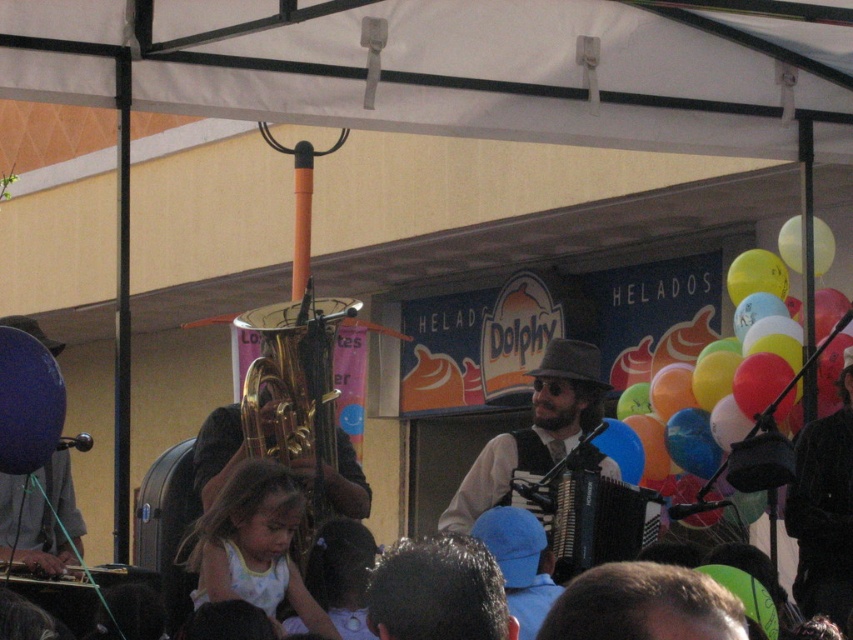
Is matte brown hat at center below blue matte balloon at left?

Indeed, matte brown hat at center is positioned under blue matte balloon at left.

Is matte brown hat at center to the left of blue matte balloon at left from the viewer's perspective?

Incorrect, matte brown hat at center is not on the left side of blue matte balloon at left.

Find the location of `matte brown hat at center`. matte brown hat at center is located at coordinates (534, 429).

Who is more forward, (x=828, y=588) or (x=795, y=260)?

Point (x=828, y=588)

Can you confirm if matte black hat at center is smaller than yellow matte balloon at upper right?

No.

Between point (846, 394) and point (819, 244), which one is positioned in front?

Point (846, 394)

You are a GUI agent. You are given a task and a screenshot of the screen. Output one action in this format:
    pyautogui.click(x=<x>, y=<y>)
    Task: Click on the matte black hat at center
    The height and width of the screenshot is (640, 853).
    Given the screenshot: What is the action you would take?
    pyautogui.click(x=824, y=508)

Is matte brown hat at center thinner than matte black hat at center?

No.

Is matte brown hat at center behind matte black hat at center?

Yes.

Does point (558, 340) lie behind point (828, 480)?

Yes.

Identify the location of matte brown hat at center. (534, 429).